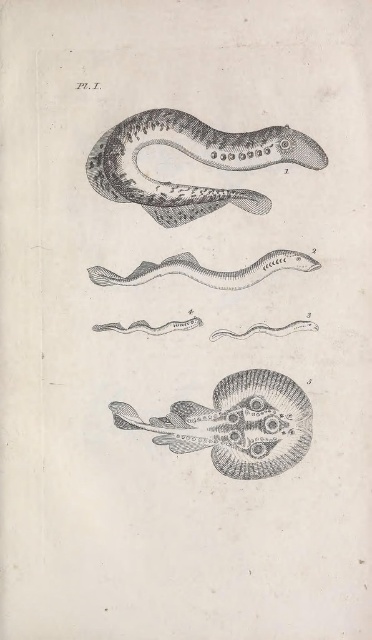
Question: Based on their relative distances, which object is nearer to the black line drawing snake at upper center?

Choices:
 (A) gray line drawing snake at center
 (B) etched paper stingray at center

Answer: (A)

Question: Can you confirm if etched paper stingray at center is positioned to the left of gray line drawing snake at center?

Choices:
 (A) yes
 (B) no

Answer: (B)

Question: Which point appears farthest from the camera in this image?

Choices:
 (A) (274, 269)
 (B) (133, 179)
 (C) (254, 403)

Answer: (C)

Question: Does etched paper stingray at center lie behind gray line drawing snake at center?

Choices:
 (A) no
 (B) yes

Answer: (B)

Question: Which of these objects is positioned farthest from the gray line drawing snake at center?

Choices:
 (A) etched paper stingray at center
 (B) black line drawing snake at upper center

Answer: (A)

Question: Can you confirm if etched paper stingray at center is bigger than gray line drawing snake at center?

Choices:
 (A) yes
 (B) no

Answer: (A)